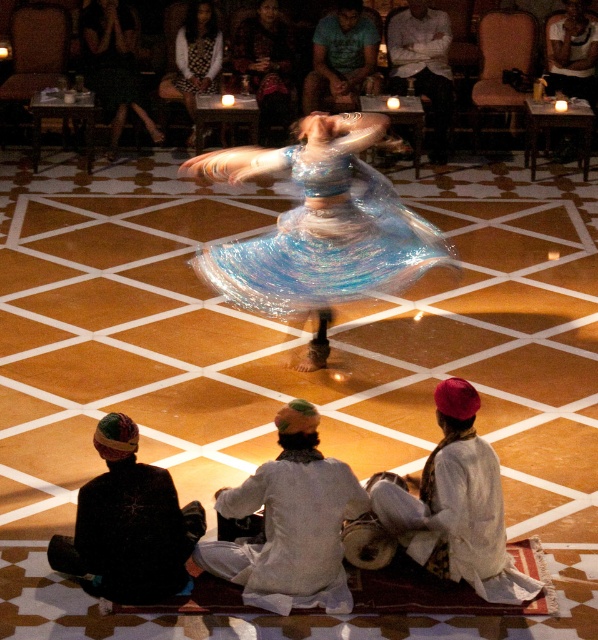
In the scene shown: You are a photographer standing at the center of the room. You want to take a photo of the shiny black dress at upper center. Where should you point your camera?

The shiny black dress at upper center is located at coordinates 0.103 on the x axis and 0.191 on the y axis, so you should point your camera towards that position.

You are a photographer positioned at the camera. You want to capture a closeup shot of the iridescent fabric dress at center. Given that the dress is 23.65 feet away from you, is it feasible to adjust your camera settings to get a clear closeup without moving closer?

The iridescent fabric dress at center is 23.65 feet away from the camera. To capture a clear closeup, you would need a lens with sufficient zoom capability to cover this distance. If your camera has a telephoto lens or zoom function capable of magnifying subjects at that range, then yes, it is feasible. Otherwise, moving closer might be necessary.